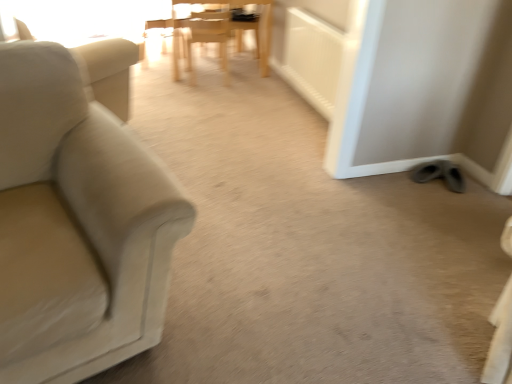
Question: Is wooden chair at center, the 1th chair viewed from the back, far from beige fabric couch at left, arranged as the third chair when viewed from the back?

Choices:
 (A) no
 (B) yes

Answer: (B)

Question: Is wooden chair at center, the 1th chair viewed from the back, oriented away from beige fabric couch at left, arranged as the third chair when viewed from the back?

Choices:
 (A) yes
 (B) no

Answer: (B)

Question: Is wooden chair at center, acting as the 1th chair starting from the top, to the left of beige fabric couch at left, which is counted as the 3th chair, starting from the top, from the viewer's perspective?

Choices:
 (A) yes
 (B) no

Answer: (B)

Question: From a real-world perspective, is wooden chair at center, which ranks as the 3th chair in front-to-back order, physically above beige fabric couch at left, which is counted as the 3th chair, starting from the top?

Choices:
 (A) yes
 (B) no

Answer: (B)

Question: Does wooden chair at center, the third chair when ordered from bottom to top, have a lesser height compared to beige fabric couch at left, marked as the first chair in a bottom-to-top arrangement?

Choices:
 (A) no
 (B) yes

Answer: (B)

Question: Based on their sizes in the image, would you say gray suede shoes at lower right is bigger or smaller than beige fabric swivel chair at left?

Choices:
 (A) small
 (B) big

Answer: (A)

Question: Relative to beige fabric swivel chair at left, is gray suede shoes at lower right in front or behind?

Choices:
 (A) behind
 (B) front

Answer: (A)

Question: Is point (419, 177) positioned closer to the camera than point (109, 104)?

Choices:
 (A) farther
 (B) closer

Answer: (B)

Question: Looking at their shapes, would you say gray suede shoes at lower right is wider or thinner than beige fabric swivel chair at left?

Choices:
 (A) wide
 (B) thin

Answer: (B)

Question: Considering the positions of point click(x=435, y=162) and point click(x=263, y=62), is point click(x=435, y=162) closer or farther from the camera than point click(x=263, y=62)?

Choices:
 (A) farther
 (B) closer

Answer: (B)

Question: Considering the positions of gray suede shoes at lower right and wooden chair at center, the third chair when ordered from bottom to top, in the image, is gray suede shoes at lower right taller or shorter than wooden chair at center, the third chair when ordered from bottom to top,?

Choices:
 (A) short
 (B) tall

Answer: (A)

Question: From the image's perspective, is gray suede shoes at lower right positioned above or below wooden chair at center, the third chair when ordered from bottom to top?

Choices:
 (A) above
 (B) below

Answer: (B)

Question: Would you say gray suede shoes at lower right is to the left or to the right of wooden chair at center, the 1th chair viewed from the back, in the picture?

Choices:
 (A) right
 (B) left

Answer: (A)

Question: Is point (212, 29) closer or farther from the camera than point (135, 59)?

Choices:
 (A) closer
 (B) farther

Answer: (B)

Question: Is wooden chair at center, the 2th chair positioned from the bottom, wider or thinner than beige fabric swivel chair at left?

Choices:
 (A) wide
 (B) thin

Answer: (B)